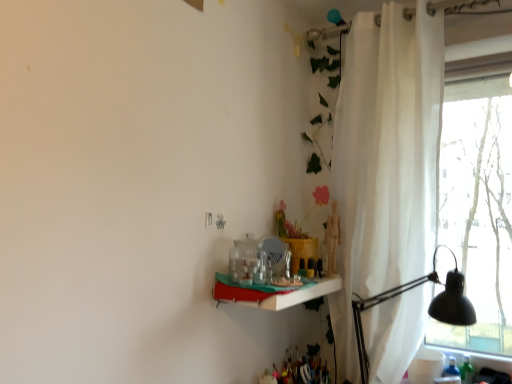
Question: Is white sheer curtain at right bigger than white glossy shelf at center?

Choices:
 (A) no
 (B) yes

Answer: (B)

Question: Considering the relative sizes of white sheer curtain at right and white glossy shelf at center in the image provided, is white sheer curtain at right shorter than white glossy shelf at center?

Choices:
 (A) no
 (B) yes

Answer: (A)

Question: From the image's perspective, does white sheer curtain at right appear higher than white glossy shelf at center?

Choices:
 (A) no
 (B) yes

Answer: (B)

Question: Considering the relative positions of white sheer curtain at right and white glossy shelf at center in the image provided, is white sheer curtain at right to the right of white glossy shelf at center from the viewer's perspective?

Choices:
 (A) no
 (B) yes

Answer: (B)

Question: Can you confirm if white sheer curtain at right is taller than white glossy shelf at center?

Choices:
 (A) no
 (B) yes

Answer: (B)

Question: Would you say black metal table lamp at right is inside or outside white glossy shelf at center?

Choices:
 (A) outside
 (B) inside

Answer: (A)

Question: Considering the positions of point (448, 273) and point (296, 286), is point (448, 273) closer or farther from the camera than point (296, 286)?

Choices:
 (A) closer
 (B) farther

Answer: (B)

Question: From a real-world perspective, is black metal table lamp at right positioned above or below white glossy shelf at center?

Choices:
 (A) below
 (B) above

Answer: (A)

Question: In the image, is black metal table lamp at right positioned in front of or behind white glossy shelf at center?

Choices:
 (A) front
 (B) behind

Answer: (B)

Question: From the image's perspective, is white sheer curtain at right located above or below white glossy shelf at center?

Choices:
 (A) above
 (B) below

Answer: (A)

Question: Is point (384, 67) positioned closer to the camera than point (229, 289)?

Choices:
 (A) farther
 (B) closer

Answer: (A)

Question: Do you think white sheer curtain at right is within white glossy shelf at center, or outside of it?

Choices:
 (A) inside
 (B) outside

Answer: (B)

Question: In terms of size, does white sheer curtain at right appear bigger or smaller than white glossy shelf at center?

Choices:
 (A) big
 (B) small

Answer: (A)

Question: From a real-world perspective, is black metal table lamp at right positioned above or below white sheer curtain at right?

Choices:
 (A) above
 (B) below

Answer: (B)

Question: Looking at their shapes, would you say black metal table lamp at right is wider or thinner than white sheer curtain at right?

Choices:
 (A) thin
 (B) wide

Answer: (B)